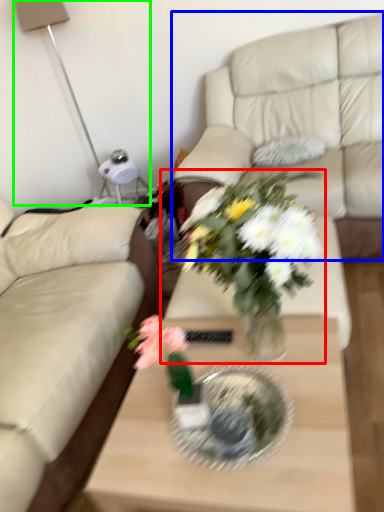
Question: Estimate the real-world distances between objects in this image. Which object is closer to houseplant (highlighted by a red box), studio couch (highlighted by a blue box) or table lamp (highlighted by a green box)?

Choices:
 (A) studio couch
 (B) table lamp

Answer: (A)